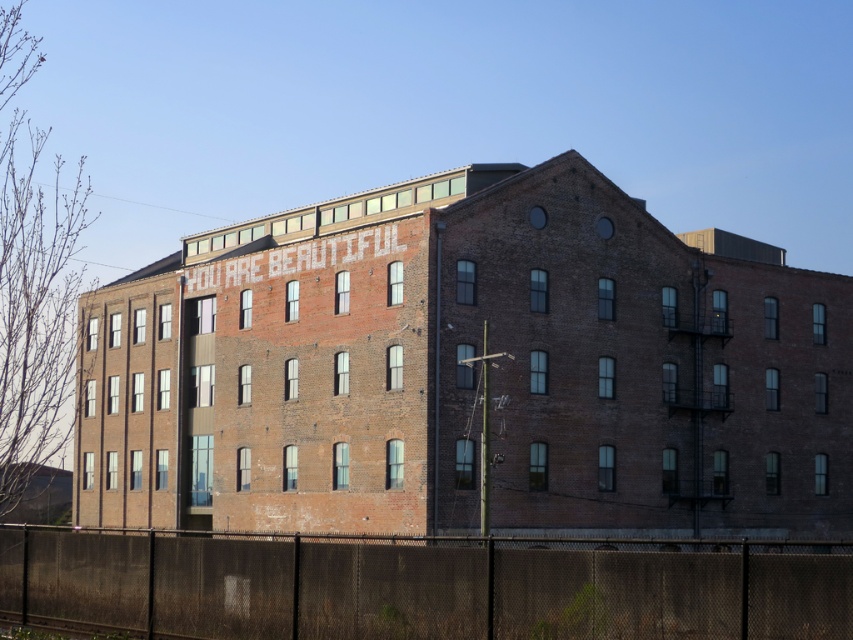
Between brown brick building at center and black mesh fence at lower center, which one is positioned higher?

brown brick building at center is higher up.

Can you confirm if brown brick building at center is shorter than black mesh fence at lower center?

No, brown brick building at center is not shorter than black mesh fence at lower center.

Locate an element on the screen. brown brick building at center is located at coordinates (468, 369).

In order to click on brown brick building at center in this screenshot , I will do `click(468, 369)`.